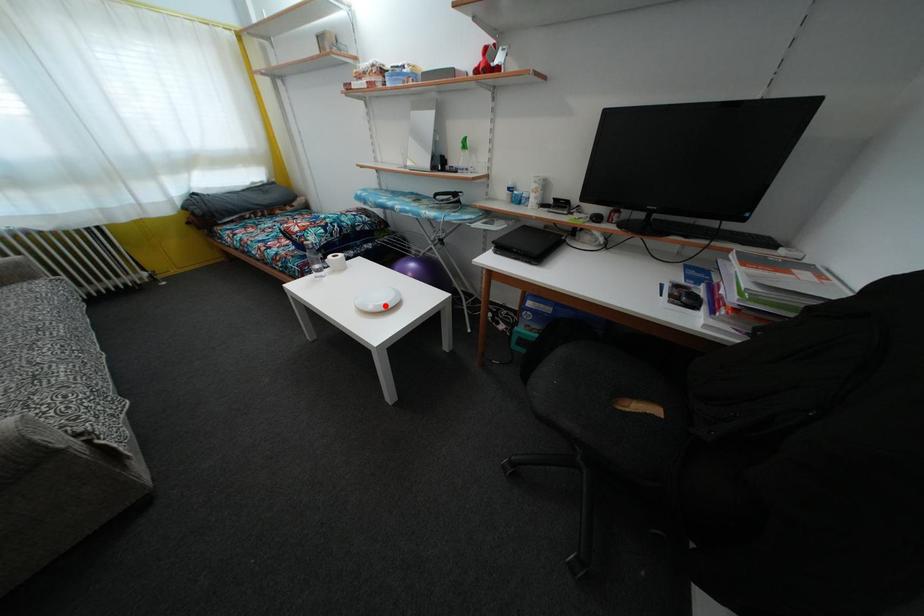
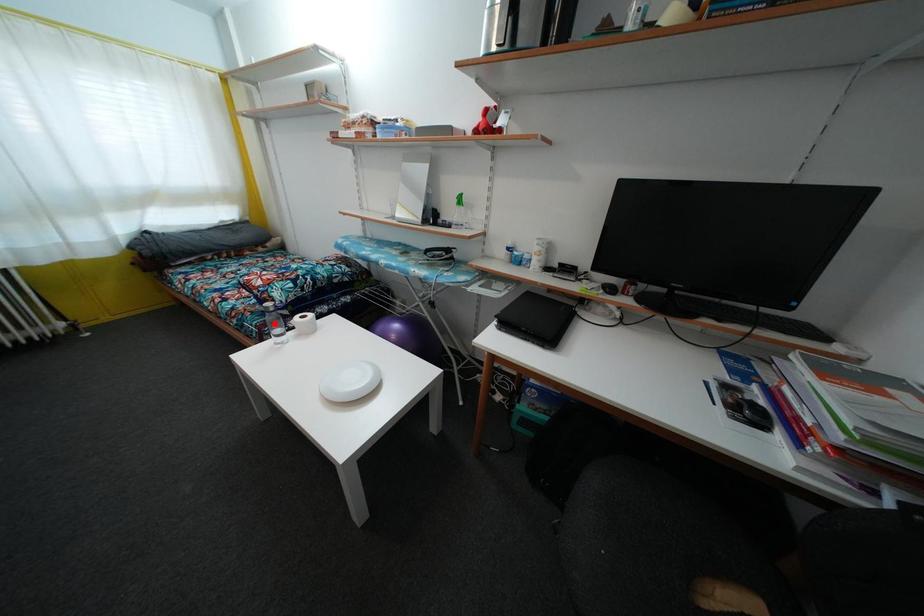
I am providing you with two images of the same scene from different viewpoints. A red point is marked on the first image and another point is marked on the second image. Does the point marked in image1 correspond to the same location as the one in image2?

No